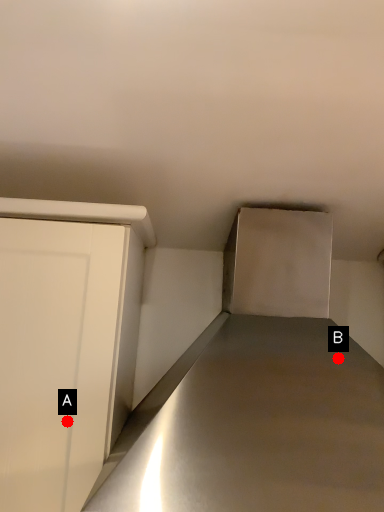
Question: Two points are circled on the image, labeled by A and B beside each circle. Which point is further to the camera?

Choices:
 (A) A is further
 (B) B is further

Answer: (B)